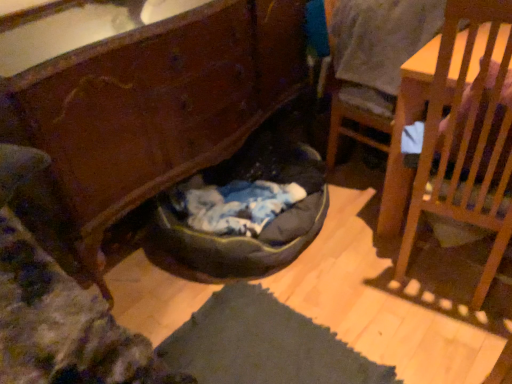
Question: Is white cotton shirt at upper right a part of wooden chair at right, placed as the second chair when sorted from left to right?

Choices:
 (A) yes
 (B) no

Answer: (B)

Question: Is wooden chair at right, placed as the second chair when sorted from left to right, thinner than white cotton shirt at upper right?

Choices:
 (A) yes
 (B) no

Answer: (A)

Question: From a real-world perspective, is wooden chair at right, placed as the second chair when sorted from left to right, beneath white cotton shirt at upper right?

Choices:
 (A) no
 (B) yes

Answer: (B)

Question: Is white cotton shirt at upper right at the back of wooden chair at right, the first chair in the right-to-left sequence?

Choices:
 (A) no
 (B) yes

Answer: (A)

Question: From a real-world perspective, is wooden chair at right, placed as the second chair when sorted from left to right, positioned over white cotton shirt at upper right based on gravity?

Choices:
 (A) yes
 (B) no

Answer: (B)

Question: Is wooden chair at right, placed as the second chair when sorted from left to right, not close to white cotton shirt at upper right?

Choices:
 (A) no
 (B) yes

Answer: (A)

Question: From the image's perspective, is wooden chair at right, marked as the second chair in a right-to-left arrangement, below wooden cabinet at lower center?

Choices:
 (A) no
 (B) yes

Answer: (A)

Question: Does wooden chair at right, placed as the first chair when sorted from left to right, have a smaller size compared to wooden cabinet at lower center?

Choices:
 (A) yes
 (B) no

Answer: (A)

Question: From the image's perspective, is wooden chair at right, placed as the first chair when sorted from left to right, on wooden cabinet at lower center?

Choices:
 (A) no
 (B) yes

Answer: (B)

Question: Is wooden chair at right, marked as the second chair in a right-to-left arrangement, far away from wooden cabinet at lower center?

Choices:
 (A) no
 (B) yes

Answer: (A)

Question: Is the position of wooden chair at right, marked as the second chair in a right-to-left arrangement, less distant than that of wooden cabinet at lower center?

Choices:
 (A) yes
 (B) no

Answer: (B)

Question: Can you confirm if wooden chair at right, placed as the first chair when sorted from left to right, is thinner than wooden cabinet at lower center?

Choices:
 (A) no
 (B) yes

Answer: (B)

Question: Is wooden chair at right, the first chair in the right-to-left sequence, thinner than dark gray fabric bean bag at lower center?

Choices:
 (A) yes
 (B) no

Answer: (A)